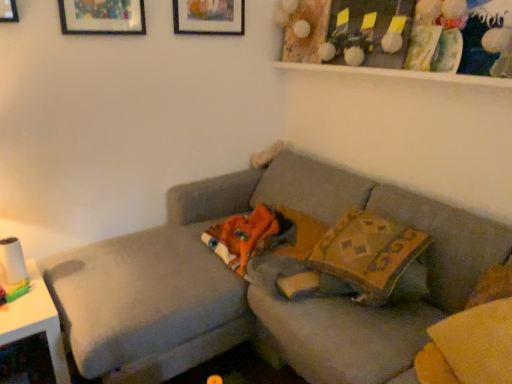
You are a GUI agent. You are given a task and a screenshot of the screen. Output one action in this format:
    pyautogui.click(x=<x>, y=<y>)
    Task: Click on the patterned fabric pillow at center
    The width and height of the screenshot is (512, 384).
    Given the screenshot: What is the action you would take?
    pyautogui.click(x=371, y=255)

What is the approximate height of matte wooden picture frame at upper center?

matte wooden picture frame at upper center is 7.53 inches tall.

What do you see at coordinates (257, 287) in the screenshot?
I see `textured gray couch at center` at bounding box center [257, 287].

Identify the location of patterned fabric pillow at center. The height and width of the screenshot is (384, 512). (371, 255).

Is white glossy table at left not close to matte wooden picture frame at upper center?

Yes, white glossy table at left and matte wooden picture frame at upper center are located far from each other.

Consider the image. Considering the relative sizes of white glossy table at left and matte wooden picture frame at upper center in the image provided, is white glossy table at left wider than matte wooden picture frame at upper center?

Yes, white glossy table at left is wider than matte wooden picture frame at upper center.

Considering the relative sizes of white glossy table at left and matte wooden picture frame at upper center in the image provided, is white glossy table at left taller than matte wooden picture frame at upper center?

Yes, white glossy table at left is taller than matte wooden picture frame at upper center.

Is patterned fabric pillow at center inside the boundaries of wooden shelf at upper center, or outside?

patterned fabric pillow at center is outside wooden shelf at upper center.

Locate an element on the screen. This screenshot has width=512, height=384. shelf above the patterned fabric pillow at center (from the image's perspective) is located at coordinates pos(404,39).

Which object is thinner, patterned fabric pillow at center or wooden shelf at upper center?

wooden shelf at upper center.

Are patterned fabric pillow at center and wooden shelf at upper center far apart?

No.

Is patterned fabric pillow at center completely or partially inside wooden shelf at upper center?

No, patterned fabric pillow at center is not surrounded by wooden shelf at upper center.

Considering the relative positions of wooden shelf at upper center and patterned fabric pillow at center in the image provided, is wooden shelf at upper center to the left of patterned fabric pillow at center from the viewer's perspective?

No, wooden shelf at upper center is not to the left of patterned fabric pillow at center.

Is wooden shelf at upper center facing towards patterned fabric pillow at center?

No, wooden shelf at upper center is not aimed at patterned fabric pillow at center.

Does point (498, 27) come in front of point (399, 263)?

No, it is behind (399, 263).

From a real-world perspective, which object rests below the other?

In real-world perspective, white glossy table at left is lower.

Is white glossy table at left bigger than patterned fabric pillow at center?

Correct, white glossy table at left is larger in size than patterned fabric pillow at center.

Would you say white glossy table at left is to the left or to the right of patterned fabric pillow at center in the picture?

Clearly, white glossy table at left is on the left of patterned fabric pillow at center in the image.

Which is less distant, (49, 321) or (380, 276)?

Point (49, 321) appears to be farther away from the viewer than point (380, 276).

Can you confirm if patterned fabric pillow at center is shorter than textured gray couch at center?

Yes, patterned fabric pillow at center is shorter than textured gray couch at center.

Is patterned fabric pillow at center bigger or smaller than textured gray couch at center?

In the image, patterned fabric pillow at center appears to be smaller than textured gray couch at center.

Is patterned fabric pillow at center not within textured gray couch at center?

No, patterned fabric pillow at center is inside textured gray couch at center's boundary.

From a real-world perspective, is patterned fabric pillow at center over textured gray couch at center?

Indeed, from a real-world perspective, patterned fabric pillow at center stands above textured gray couch at center.

Considering the relative positions of textured gray couch at center and white glossy table at left in the image provided, is textured gray couch at center to the left of white glossy table at left from the viewer's perspective?

Incorrect, textured gray couch at center is not on the left side of white glossy table at left.

From the image's perspective, which object appears higher, textured gray couch at center or white glossy table at left?

textured gray couch at center appears higher in the image.

From a real-world perspective, who is located lower, textured gray couch at center or white glossy table at left?

In real-world perspective, white glossy table at left is lower.

Can you confirm if textured gray couch at center is thinner than white glossy table at left?

Incorrect, the width of textured gray couch at center is not less than that of white glossy table at left.

What's the angular difference between white glossy table at left and wooden shelf at upper center's facing directions?

The angular difference between white glossy table at left and wooden shelf at upper center is 87.9 degrees.

I want to click on table that appears behind the wooden shelf at upper center, so click(36, 321).

Is white glossy table at left beside wooden shelf at upper center?

white glossy table at left is not next to wooden shelf at upper center, and they're not touching.

Is point (29, 312) less distant than point (432, 1)?

Yes, it is in front of point (432, 1).

The height and width of the screenshot is (384, 512). What are the coordinates of `picture frame above the white glossy table at left (from the image's perspective)` in the screenshot? It's located at (209, 17).

Locate an element on the screen. shelf that appears in front of the patterned fabric pillow at center is located at coordinates (404, 39).

Estimate the real-world distances between objects in this image. Which object is further from white glossy table at left, patterned fabric pillow at center or matte wooden picture frame at upper center?

matte wooden picture frame at upper center is further to white glossy table at left.

Looking at the image, which one is located closer to white glossy table at left, textured gray couch at center or patterned fabric pillow at center?

Based on the image, textured gray couch at center appears to be nearer to white glossy table at left.

Looking at the image, which one is located closer to matte wooden picture frame at upper center, textured gray couch at center or white glossy table at left?

textured gray couch at center is closer to matte wooden picture frame at upper center.

Looking at the image, which one is located further to wooden shelf at upper center, textured gray couch at center or matte wooden picture frame at upper center?

textured gray couch at center.

Estimate the real-world distances between objects in this image. Which object is closer to patterned fabric pillow at center, textured gray couch at center or white glossy table at left?

textured gray couch at center.

When comparing their distances from matte wooden picture frame at upper center, does wooden shelf at upper center or textured gray couch at center seem closer?

The object closer to matte wooden picture frame at upper center is wooden shelf at upper center.

Looking at the image, which one is located further to wooden shelf at upper center, white glossy table at left or matte wooden picture frame at upper center?

Among the two, white glossy table at left is located further to wooden shelf at upper center.

When comparing their distances from wooden shelf at upper center, does matte wooden picture frame at upper center or textured gray couch at center seem further?

textured gray couch at center lies further to wooden shelf at upper center than the other object.

You are a GUI agent. You are given a task and a screenshot of the screen. Output one action in this format:
    pyautogui.click(x=<x>, y=<y>)
    Task: Click on the studio couch situated between white glossy table at left and wooden shelf at upper center from left to right
    This screenshot has height=384, width=512.
    Given the screenshot: What is the action you would take?
    pyautogui.click(x=257, y=287)

In order to click on throw pillow between matte wooden picture frame at upper center and white glossy table at left in the vertical direction in this screenshot , I will do `click(371, 255)`.

Locate an element on the screen. throw pillow located between white glossy table at left and wooden shelf at upper center in the left-right direction is located at coordinates (371, 255).

Where is `studio couch between matte wooden picture frame at upper center and white glossy table at left in the up-down direction`? The height and width of the screenshot is (384, 512). studio couch between matte wooden picture frame at upper center and white glossy table at left in the up-down direction is located at coordinates (257, 287).